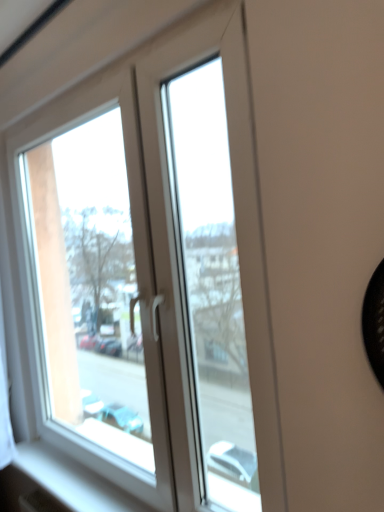
Locate an element on the screen. empty space that is ontop of white plastic window at upper left is located at coordinates (89, 71).